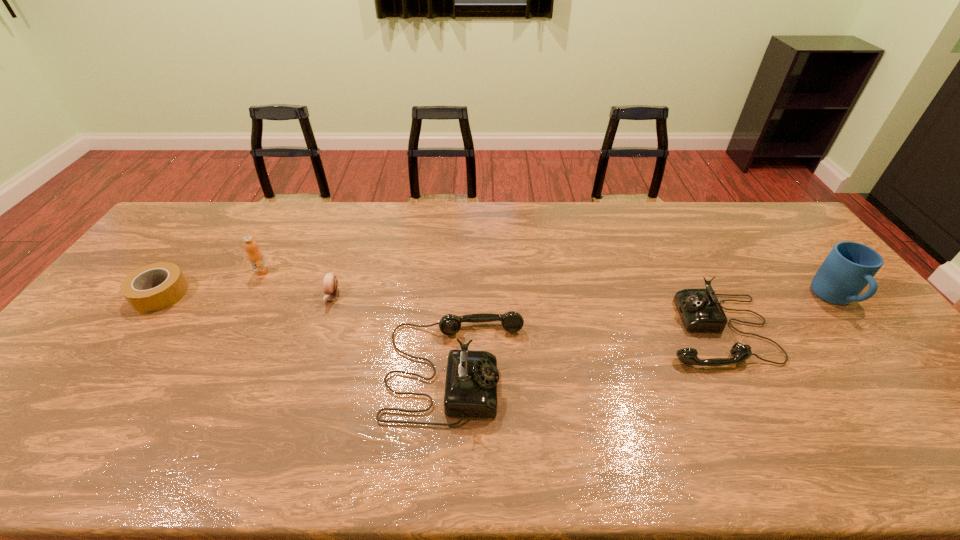
In order to click on free area in between the mug and the duct tape in this screenshot , I will do `click(497, 297)`.

Where is `free spot between the second object from left to right and the right telephone`? The height and width of the screenshot is (540, 960). free spot between the second object from left to right and the right telephone is located at coordinates (489, 300).

You are a GUI agent. You are given a task and a screenshot of the screen. Output one action in this format:
    pyautogui.click(x=<x>, y=<y>)
    Task: Click on the empty location between the third object from left to right and the duct tape
    This screenshot has height=540, width=960.
    Given the screenshot: What is the action you would take?
    pyautogui.click(x=246, y=295)

I want to click on vacant space that is in between the second object from left to right and the leftmost object, so click(210, 283).

At what (x,y) coordinates should I click in order to perform the action: click on vacant space that's between the shorter telephone and the mug. Please return your answer as a coordinate pair (x, y). The height and width of the screenshot is (540, 960). Looking at the image, I should click on (775, 314).

Where is `the closest object to the mug`? This screenshot has width=960, height=540. the closest object to the mug is located at coordinates (700, 310).

At what (x,y) coordinates should I click in order to perform the action: click on object that is the second nearest to the orange juice. Please return your answer as a coordinate pair (x, y). The height and width of the screenshot is (540, 960). Looking at the image, I should click on (330, 282).

You are a GUI agent. You are given a task and a screenshot of the screen. Output one action in this format:
    pyautogui.click(x=<x>, y=<y>)
    Task: Click on the vacant space that satisfies the following two spatial constraints: 1. on the side of the rightmost object with the handle; 2. on the dial of the shorter telephone
    Image resolution: width=960 pixels, height=540 pixels.
    Given the screenshot: What is the action you would take?
    pyautogui.click(x=859, y=329)

Locate an element on the screen. The height and width of the screenshot is (540, 960). free space in the image that satisfies the following two spatial constraints: 1. on the side of the rightmost object with the handle; 2. on the dial of the shorter telephone is located at coordinates (859, 329).